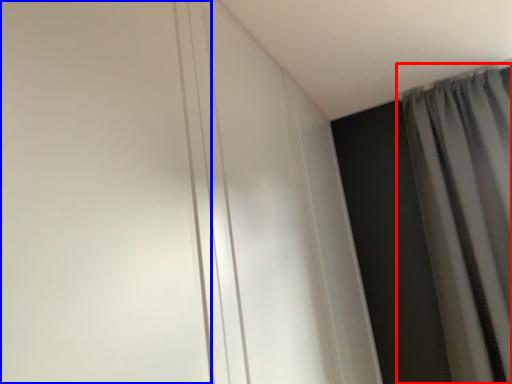
Question: Which object is closer to the camera taking this photo, curtain (highlighted by a red box) or door (highlighted by a blue box)?

Choices:
 (A) curtain
 (B) door

Answer: (B)